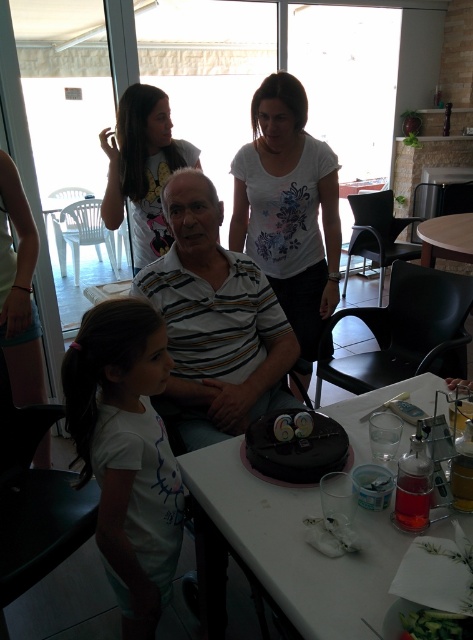
You are a photographer at this birthday gathering. You need to take a group photo that includes both the white cotton shirt at lower left and the white cotton shirt at upper center. Which shirt should you position closer to the camera to ensure both are in focus?

Answer: To ensure both the white cotton shirt at lower left and the white cotton shirt at upper center are in focus, position the smaller white cotton shirt at lower left closer to the camera since it is smaller and needs to be magnified to match the size of the larger shirt in the frame.

You are standing in the dining area and see two points marked in the image. Which point is closer to you, point (271, 202) or point (166, 97)?

Point (271, 202) is further to the viewer than point (166, 97), so point (166, 97) is closer to you.